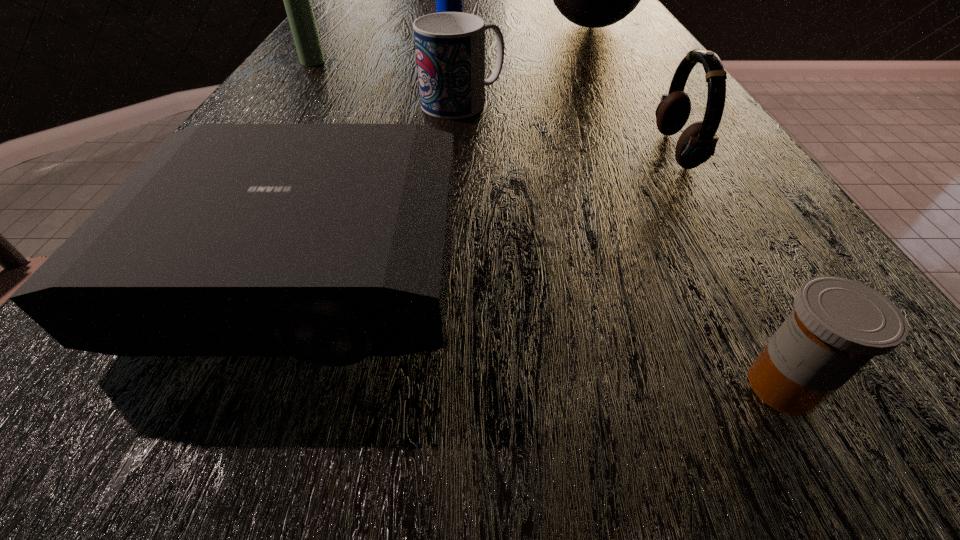
Where is `projector at the left edge`? The image size is (960, 540). projector at the left edge is located at coordinates (328, 242).

Find the location of a particular element. The image size is (960, 540). flower arrangement that is at the right edge is located at coordinates (594, 0).

At what (x,y) coordinates should I click in order to perform the action: click on headset present at the right edge. Please return your answer as a coordinate pair (x, y). Image resolution: width=960 pixels, height=540 pixels. Looking at the image, I should click on (697, 143).

Locate an element on the screen. medicine at the right edge is located at coordinates (838, 325).

Locate an element on the screen. object situated at the far right corner is located at coordinates (594, 0).

Where is `vacant space at the far edge of the desktop`? vacant space at the far edge of the desktop is located at coordinates (524, 8).

In the image, there is a desktop. Identify the location of free region at the left edge. The image size is (960, 540). (283, 104).

This screenshot has width=960, height=540. In the image, there is a desktop. What are the coordinates of `vacant space at the right edge` in the screenshot? It's located at (695, 185).

Identify the location of free space between the mug and the headset. (569, 126).

Identify the location of vacant space that's between the fifth farthest object and the tallest object. (631, 90).